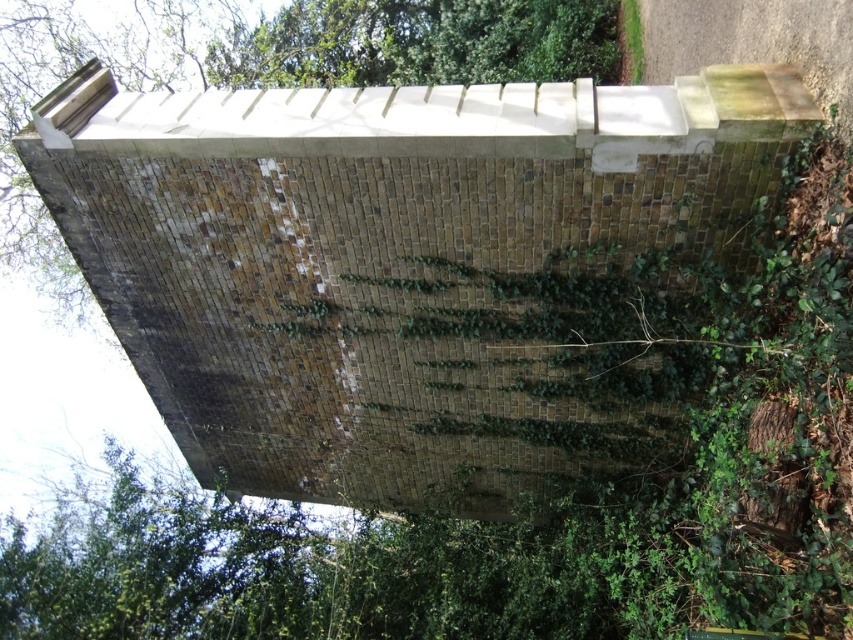
You are standing in front of a brick wall with ivy growing on it. There is a point marked at coordinates (x=276, y=72). What is located at that point?

The point at coordinates (x=276, y=72) is located on the brick wall at center.

You are an artist planning to paint this scene. You want to ensure the brick wall at center and the green leafy tree at upper center are proportionally accurate. Which object should you make wider in your painting?

The brick wall at center should be made wider in the painting because its width surpasses that of the green leafy tree at upper center according to the description.